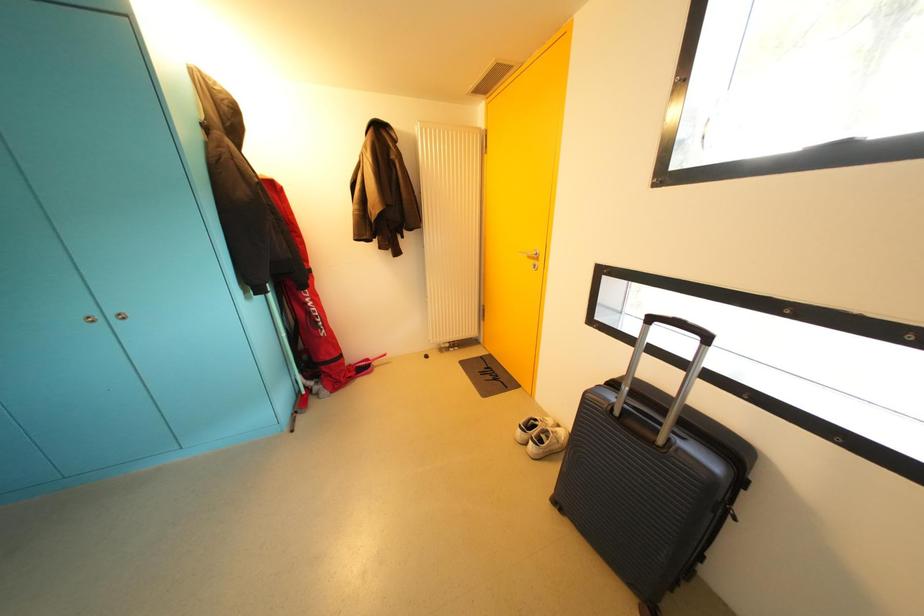
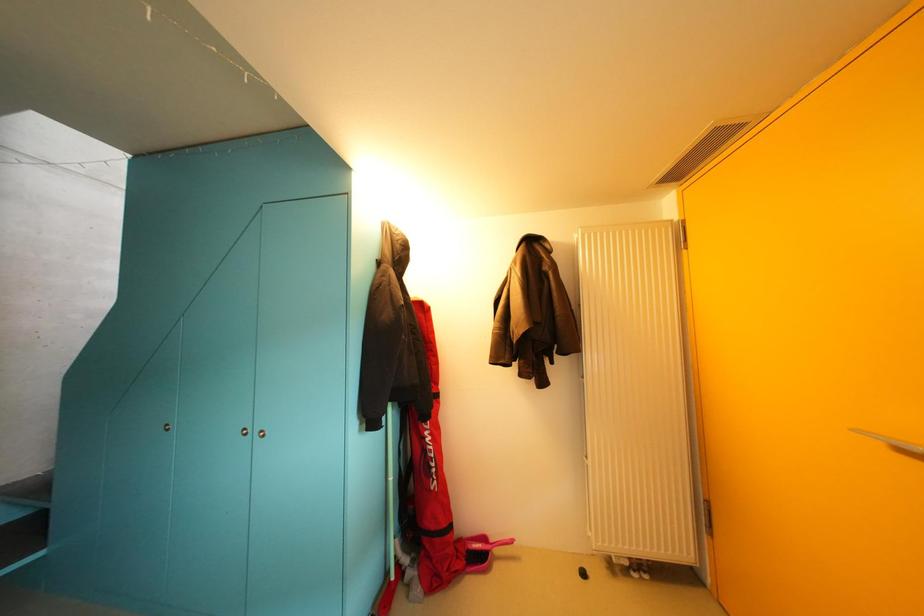
In the scene shown: The first image is from the beginning of the video and the second image is from the end. How did the camera likely rotate when shooting the video?

The camera's rotation is toward left-up.